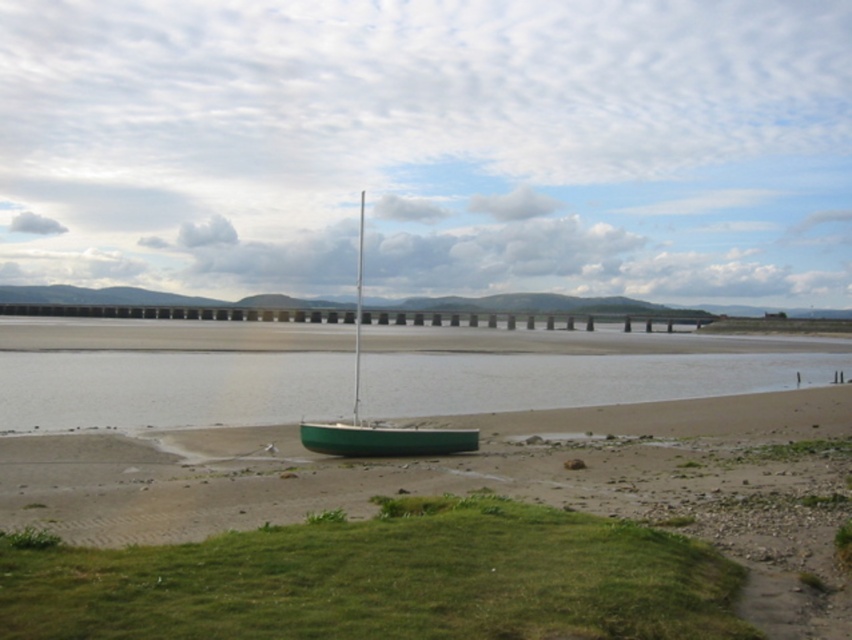
You are standing at the coordinates point 0.5, 0.5 in the image. Which direction should you move to reach the green matte sailboat at center?

Since the green matte sailboat at center is located at point (378, 426), you should move northeast to reach it from your current position at (426, 320).

You are standing on the sandy shore of the coastal scene and want to walk from point (453,433) to point (341,426). Which direction should you move to get closer to the water?

You should move towards point (341,426) because it is closer to the water than point (453,433).

You are standing at the point marked by the coordinate (378, 426) in the image. What object are you standing on?

You are standing on the green matte sailboat at center, which is represented by the point coordinates (378, 426).